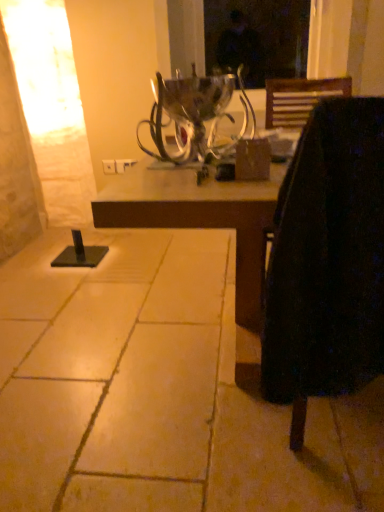
The height and width of the screenshot is (512, 384). I want to click on free space behind matte brown table at center, so click(x=166, y=259).